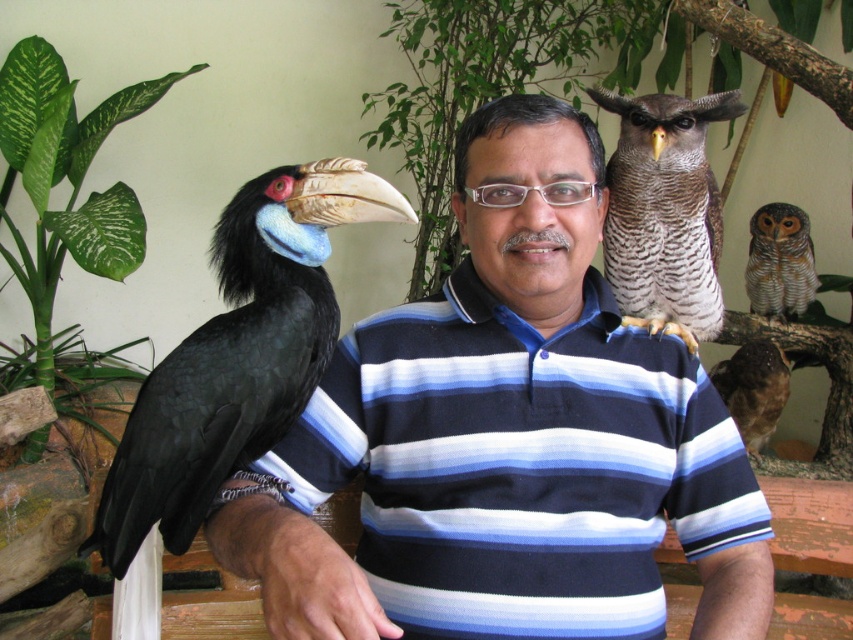
Question: Which point is closer to the camera?

Choices:
 (A) black glossy hornbill at left
 (B) blue striped shirt at upper center
 (C) striped feathered owl at upper right
 (D) speckled brown owl at upper right

Answer: (B)

Question: Does black glossy hornbill at left appear on the left side of striped feathered owl at upper right?

Choices:
 (A) no
 (B) yes

Answer: (B)

Question: Which point is closer to the camera taking this photo?

Choices:
 (A) (608, 257)
 (B) (761, 298)

Answer: (A)

Question: Where is black glossy hornbill at left located in relation to striped feathered owl at upper right in the image?

Choices:
 (A) above
 (B) below

Answer: (B)

Question: Which object is the farthest from the black glossy hornbill at left?

Choices:
 (A) blue striped shirt at upper center
 (B) speckled brown owl at upper right

Answer: (B)

Question: Is speckled brown owl at upper right further to the viewer compared to striped feathered owl at upper right?

Choices:
 (A) no
 (B) yes

Answer: (A)